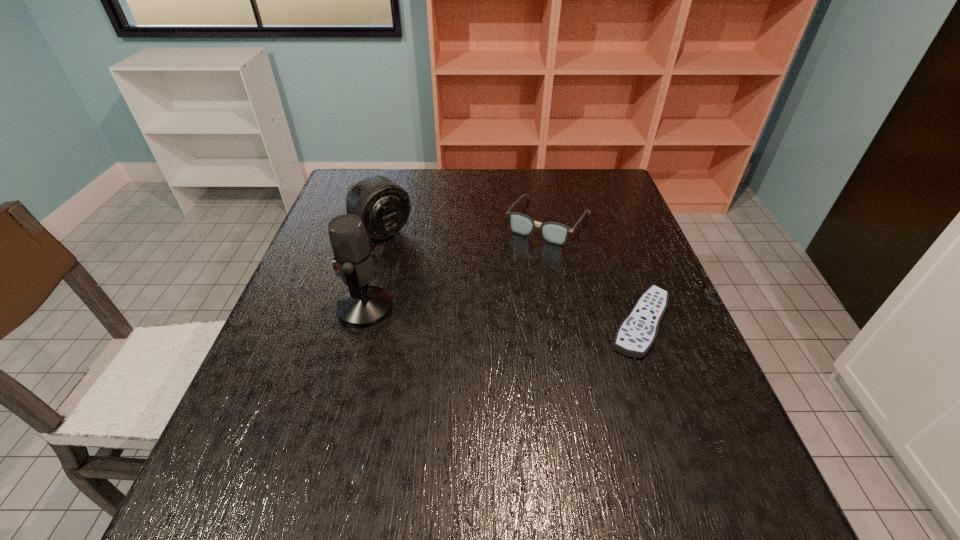
What are the coordinates of `free location at the near edge of the desktop` in the screenshot? It's located at (575, 428).

Where is `free space at the left edge`? free space at the left edge is located at coordinates (318, 335).

The image size is (960, 540). In the image, there is a desktop. What are the coordinates of `vacant space at the right edge` in the screenshot? It's located at (637, 372).

In the image, there is a desktop. What are the coordinates of `free space at the far right corner` in the screenshot? It's located at (588, 198).

The width and height of the screenshot is (960, 540). Find the location of `free space between the third shortest object and the remote control`. free space between the third shortest object and the remote control is located at coordinates (512, 276).

At what (x,y) coordinates should I click in order to perform the action: click on free spot between the tallest object and the remote control. Please return your answer as a coordinate pair (x, y). This screenshot has height=540, width=960. Looking at the image, I should click on (503, 315).

You are a GUI agent. You are given a task and a screenshot of the screen. Output one action in this format:
    pyautogui.click(x=<x>, y=<y>)
    Task: Click on the empty space that is in between the microphone and the third tallest object
    Image resolution: width=960 pixels, height=540 pixels.
    Given the screenshot: What is the action you would take?
    pyautogui.click(x=457, y=265)

At what (x,y) coordinates should I click in order to perform the action: click on vacant region between the shortest object and the microphone. Please return your answer as a coordinate pair (x, y). Looking at the image, I should click on (503, 315).

Find the location of `free space that is in between the shortest object and the spectacles`. free space that is in between the shortest object and the spectacles is located at coordinates (594, 272).

Locate an element on the screen. The width and height of the screenshot is (960, 540). free area in between the tallest object and the second shortest object is located at coordinates (457, 265).